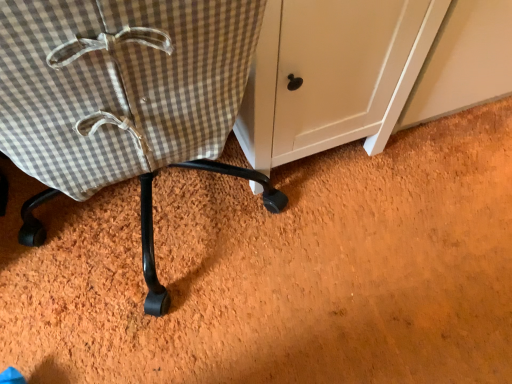
Find the location of a particular element. This screenshot has height=384, width=512. black matte chair leg at lower left is located at coordinates (123, 98).

What do you see at coordinates (123, 98) in the screenshot? I see `black matte chair leg at lower left` at bounding box center [123, 98].

What is the approximate width of black matte chair leg at lower left?

It is 22.88 inches.

You are a GUI agent. You are given a task and a screenshot of the screen. Output one action in this format:
    pyautogui.click(x=<x>, y=<y>)
    Task: Click on the black matte chair leg at lower left
    The width and height of the screenshot is (512, 384).
    Given the screenshot: What is the action you would take?
    pyautogui.click(x=123, y=98)